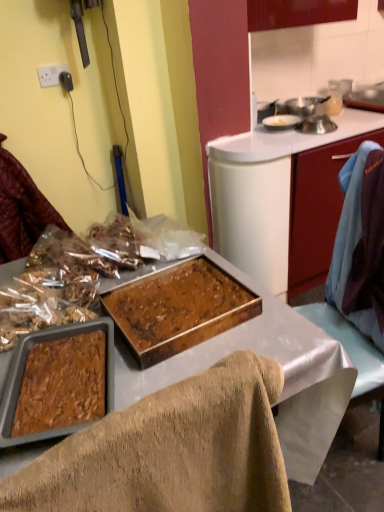
Question: Can you confirm if metallic silver pot at upper right is shorter than brown crumbly mixture at left, arranged as the 1th food when viewed from the back?

Choices:
 (A) yes
 (B) no

Answer: (B)

Question: Can you see metallic silver pot at upper right touching brown crumbly mixture at left, arranged as the 1th food when viewed from the back?

Choices:
 (A) no
 (B) yes

Answer: (A)

Question: From the image's perspective, does metallic silver pot at upper right appear lower than brown crumbly mixture at left, the 2th food in the front-to-back sequence?

Choices:
 (A) yes
 (B) no

Answer: (B)

Question: Can you confirm if metallic silver pot at upper right is bigger than brown crumbly mixture at left, arranged as the 1th food when viewed from the back?

Choices:
 (A) yes
 (B) no

Answer: (B)

Question: Is metallic silver pot at upper right to the left of brown crumbly mixture at left, arranged as the 1th food when viewed from the back, from the viewer's perspective?

Choices:
 (A) no
 (B) yes

Answer: (A)

Question: Is matte red cabinet at right to the left or to the right of metallic silver pot at upper right in the image?

Choices:
 (A) right
 (B) left

Answer: (B)

Question: Considering the positions of matte red cabinet at right and metallic silver pot at upper right in the image, is matte red cabinet at right taller or shorter than metallic silver pot at upper right?

Choices:
 (A) short
 (B) tall

Answer: (B)

Question: From the image's perspective, is matte red cabinet at right located above or below metallic silver pot at upper right?

Choices:
 (A) above
 (B) below

Answer: (B)

Question: Does point (289, 275) appear closer or farther from the camera than point (311, 96)?

Choices:
 (A) farther
 (B) closer

Answer: (B)

Question: Does point (301, 111) appear closer or farther from the camera than point (77, 259)?

Choices:
 (A) closer
 (B) farther

Answer: (B)

Question: Looking at the image, does metallic silver pot at upper right seem bigger or smaller compared to brown crumbly mixture at left, the 2th food in the front-to-back sequence?

Choices:
 (A) big
 (B) small

Answer: (B)

Question: Considering the positions of metallic silver pot at upper right and brown crumbly mixture at left, arranged as the 1th food when viewed from the back, in the image, is metallic silver pot at upper right taller or shorter than brown crumbly mixture at left, arranged as the 1th food when viewed from the back,?

Choices:
 (A) short
 (B) tall

Answer: (B)

Question: Considering their positions, is metallic silver pot at upper right located in front of or behind brown crumbly mixture at left, the 2th food in the front-to-back sequence?

Choices:
 (A) behind
 (B) front

Answer: (A)

Question: In the image, is shiny plastic bag of nuts at left on the left side or the right side of brown textured tray at center?

Choices:
 (A) right
 (B) left

Answer: (B)

Question: Is shiny plastic bag of nuts at left taller or shorter than brown textured tray at center?

Choices:
 (A) tall
 (B) short

Answer: (B)